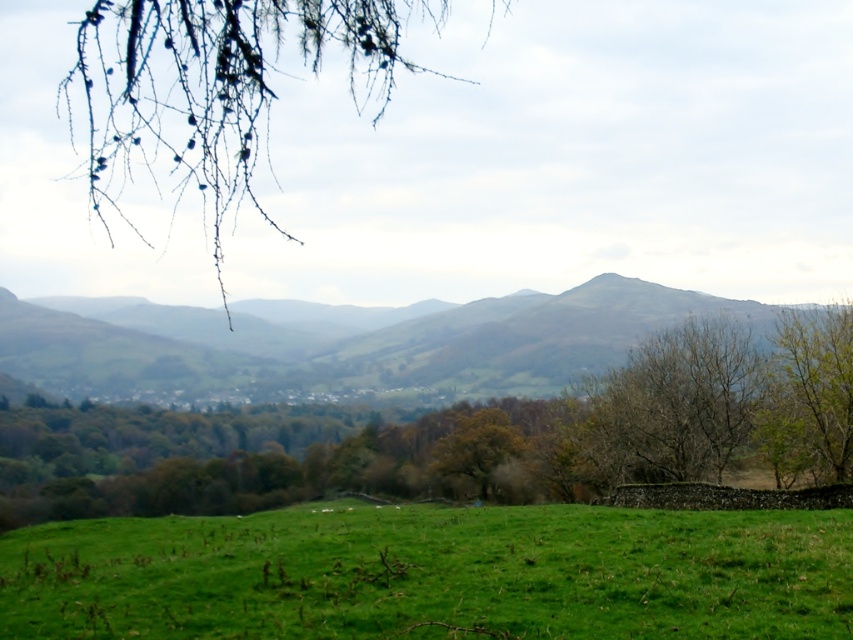
You are standing in the pasture looking towards the stone wall. You see the green leafy tree at center and the green leafy branch at upper left. Which object is closer to you?

The green leafy tree at center is closer to you because it is positioned below the green leafy branch at upper left, indicating it is in a lower part of the frame and thus nearer in the scene.

You are an artist sketching this landscape. You need to decide which object to draw first based on their sizes. Which one should you start with, the green leafy tree at center or the green leafy branch at upper left?

The green leafy tree at center should be drawn first because its width is larger than the green leafy branch at upper left, making it a more prominent feature in the landscape.